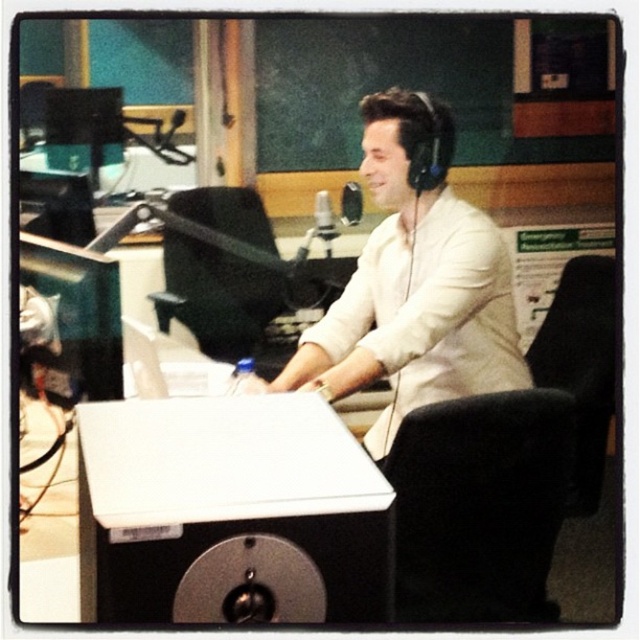
Question: Does black leather swivel chair at center appear on the left side of black leather chair at center?

Choices:
 (A) no
 (B) yes

Answer: (A)

Question: Which object is the farthest from the black leather swivel chair at center?

Choices:
 (A) black leather chair at center
 (B) white matte shirt at center

Answer: (A)

Question: Which object is the farthest from the black leather chair at center?

Choices:
 (A) white matte shirt at center
 (B) white plastic table at center

Answer: (B)

Question: Is white plastic table at center bigger than black leather swivel chair at center?

Choices:
 (A) no
 (B) yes

Answer: (A)

Question: In this image, where is white plastic table at center located relative to black leather chair at center?

Choices:
 (A) right
 (B) left

Answer: (A)

Question: Which point is farther from the camera taking this photo?

Choices:
 (A) (554, 326)
 (B) (483, 316)
 (C) (83, 488)
 (D) (164, 237)

Answer: (D)